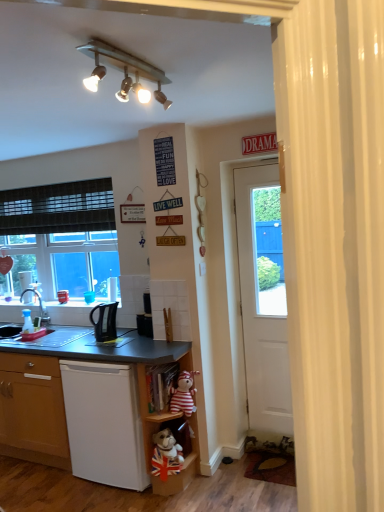
At what (x,y) coordinates should I click in order to perform the action: click on free region on the left part of black plastic kettle at lower left. Please return your answer as a coordinate pair (x, y). This screenshot has height=512, width=384. Looking at the image, I should click on (86, 343).